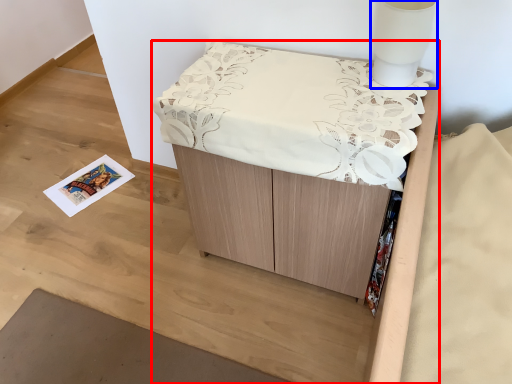
Question: Which of the following is the farthest to the observer, furniture (highlighted by a red box) or table lamp (highlighted by a blue box)?

Choices:
 (A) furniture
 (B) table lamp

Answer: (B)